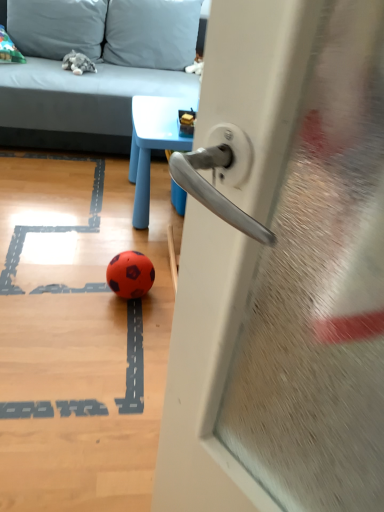
What are the coordinates of `free space in front of gray plush toy at upper left` in the screenshot? It's located at (66, 77).